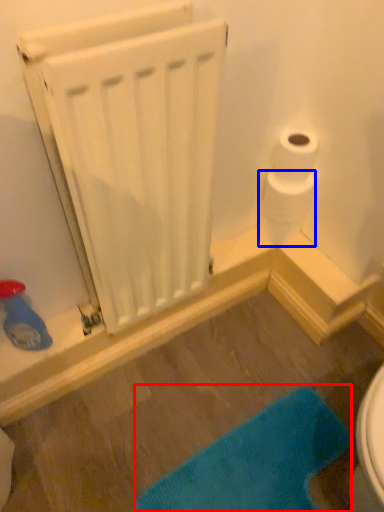
Question: Which object appears closest to the camera in this image, bath mat (highlighted by a red box) or toilet paper (highlighted by a blue box)?

Choices:
 (A) bath mat
 (B) toilet paper

Answer: (A)